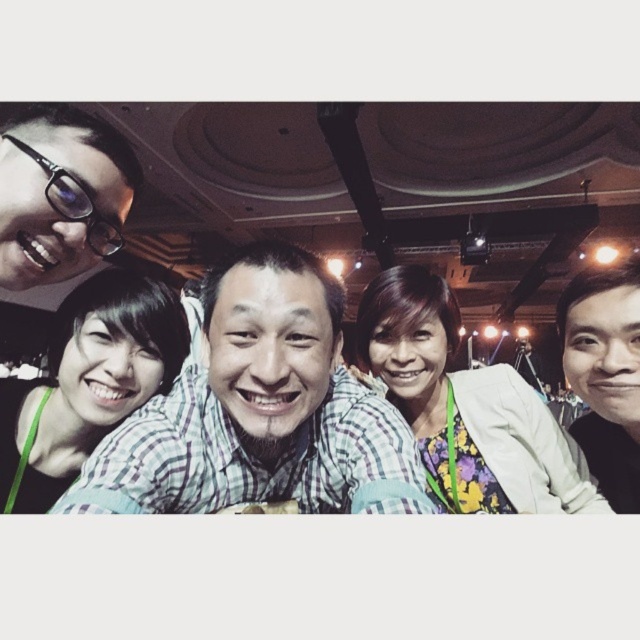
Can you confirm if checkered fabric shirt at center is positioned to the left of matte black glasses at upper left?

No, checkered fabric shirt at center is not to the left of matte black glasses at upper left.

Describe the element at coordinates (260, 410) in the screenshot. Image resolution: width=640 pixels, height=640 pixels. I see `checkered fabric shirt at center` at that location.

Which is in front, point (147, 426) or point (26, 122)?

Positioned in front is point (26, 122).

The height and width of the screenshot is (640, 640). What are the coordinates of `checkered fabric shirt at center` in the screenshot? It's located at (260, 410).

Who is shorter, floral fabric blouse at center or matte green shirt at lower left?

matte green shirt at lower left

Is point (513, 474) closer to camera compared to point (68, 390)?

No, (513, 474) is behind (68, 390).

Which is in front, point (381, 371) or point (132, 355)?

Point (132, 355)

This screenshot has width=640, height=640. Identify the location of floral fabric blouse at center. (467, 406).

Is floral fabric blouse at center wider than matte black glasses at upper left?

Yes.

Can you confirm if floral fabric blouse at center is positioned to the right of matte black glasses at upper left?

Correct, you'll find floral fabric blouse at center to the right of matte black glasses at upper left.

Between point (563, 488) and point (3, 140), which one is positioned behind?

The point (563, 488) is more distant.

At what (x,y) coordinates should I click in order to perform the action: click on floral fabric blouse at center. Please return your answer as a coordinate pair (x, y). Looking at the image, I should click on (467, 406).